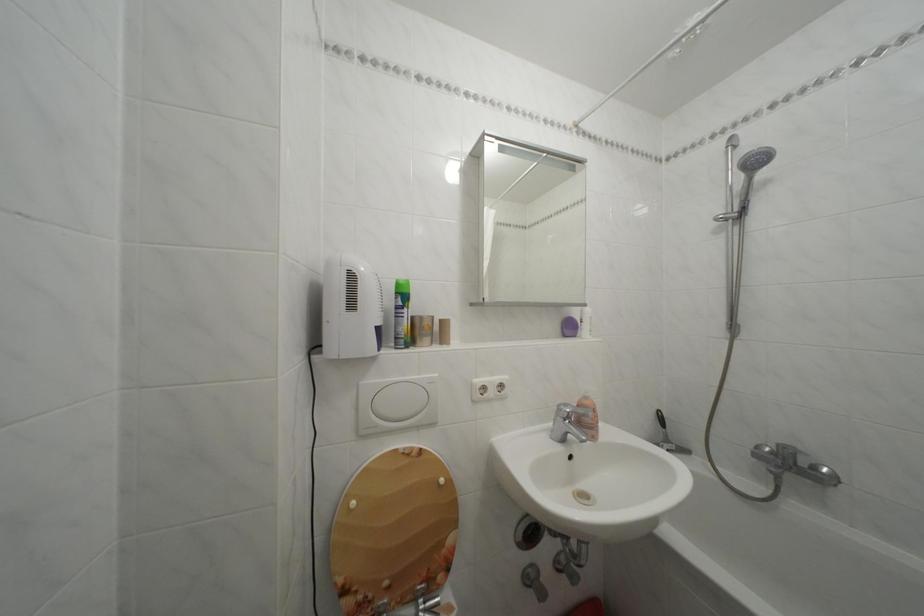
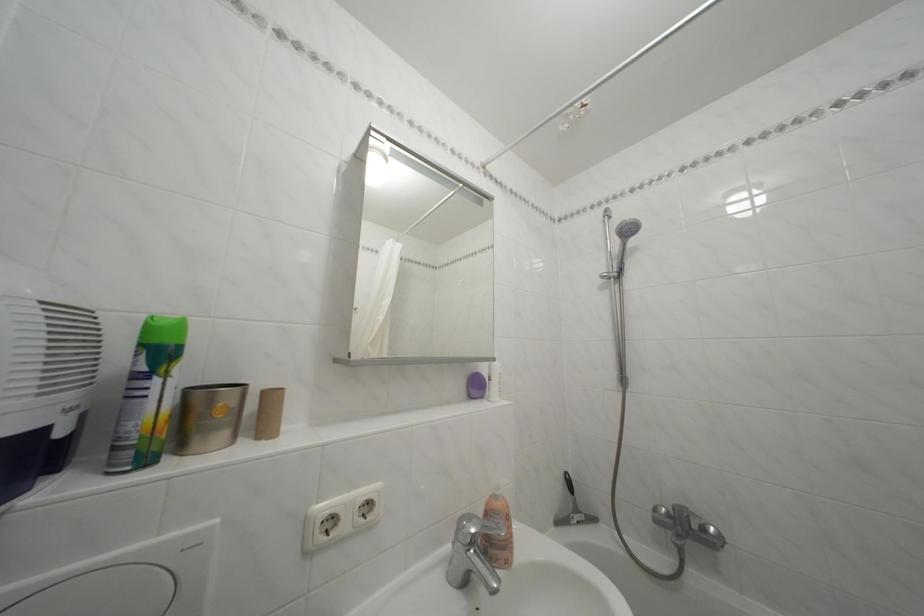
What movement of the cameraman would produce the second image?

The cameraman moved toward right, forward.